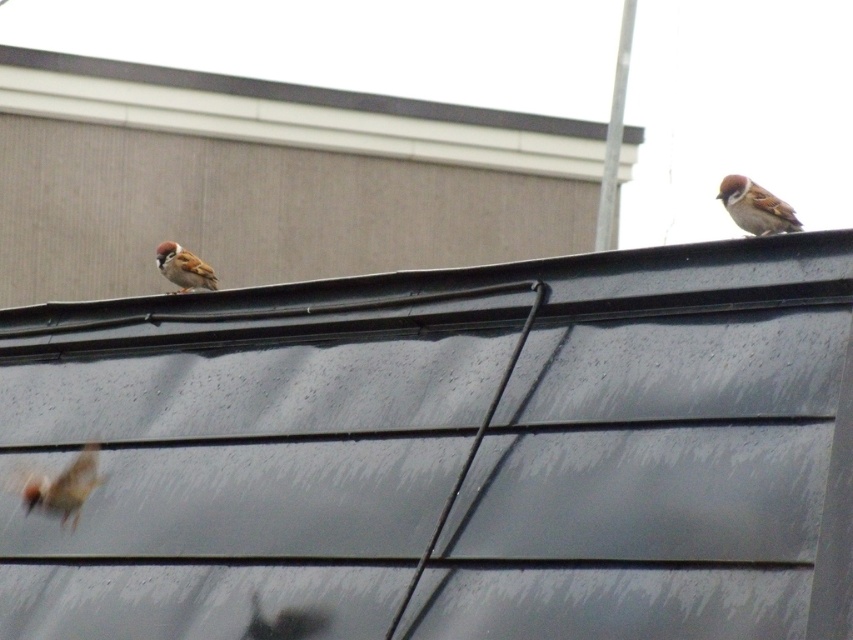
Question: Estimate the real-world distances between objects in this image. Which object is closer to the brown matte sparrow at left?

Choices:
 (A) brown speckled feathers at upper right
 (B) brown matte sparrow at lower left

Answer: (B)

Question: Does brown matte sparrow at lower left come in front of brown speckled feathers at upper right?

Choices:
 (A) yes
 (B) no

Answer: (B)

Question: Can you confirm if gray matte roof at center is thinner than brown speckled feathers at upper right?

Choices:
 (A) yes
 (B) no

Answer: (B)

Question: Is brown speckled feathers at upper right below brown matte sparrow at left?

Choices:
 (A) yes
 (B) no

Answer: (B)

Question: Which of the following is the farthest from the observer?

Choices:
 (A) (242, 577)
 (B) (753, 204)

Answer: (B)

Question: Which point appears farthest from the camera in this image?

Choices:
 (A) (318, 492)
 (B) (65, 474)
 (C) (762, 189)

Answer: (B)